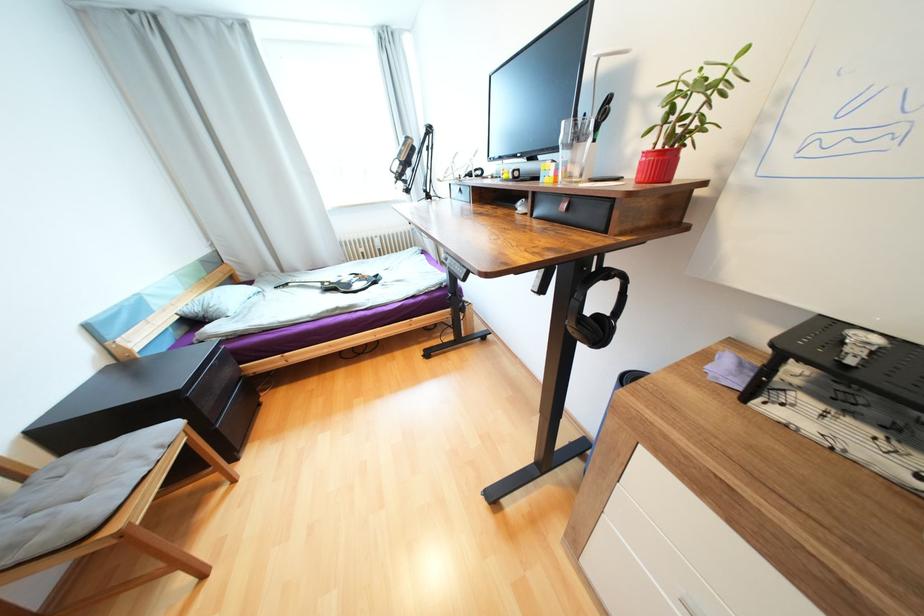
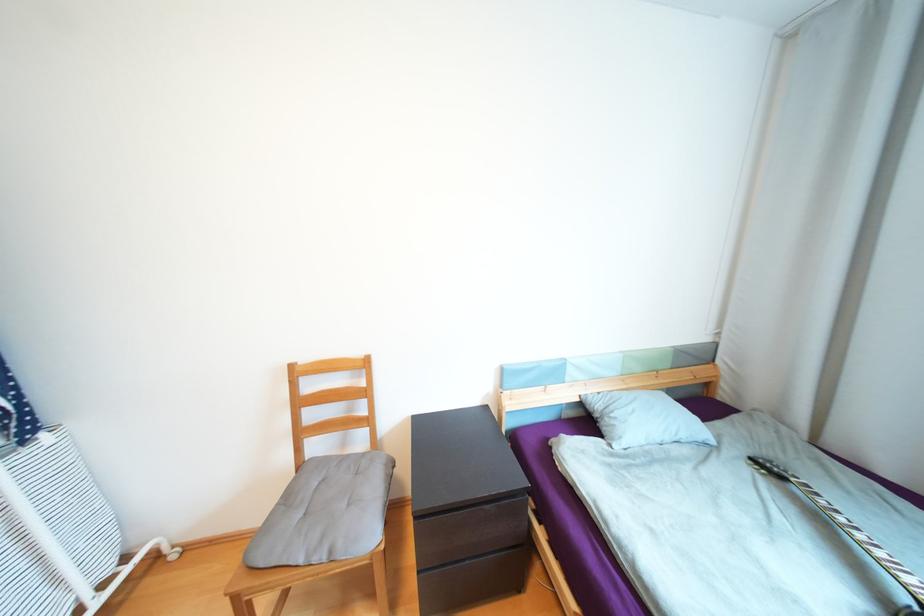
In the second image, find the point that corresponds to point (166, 447) in the first image.

(335, 553)